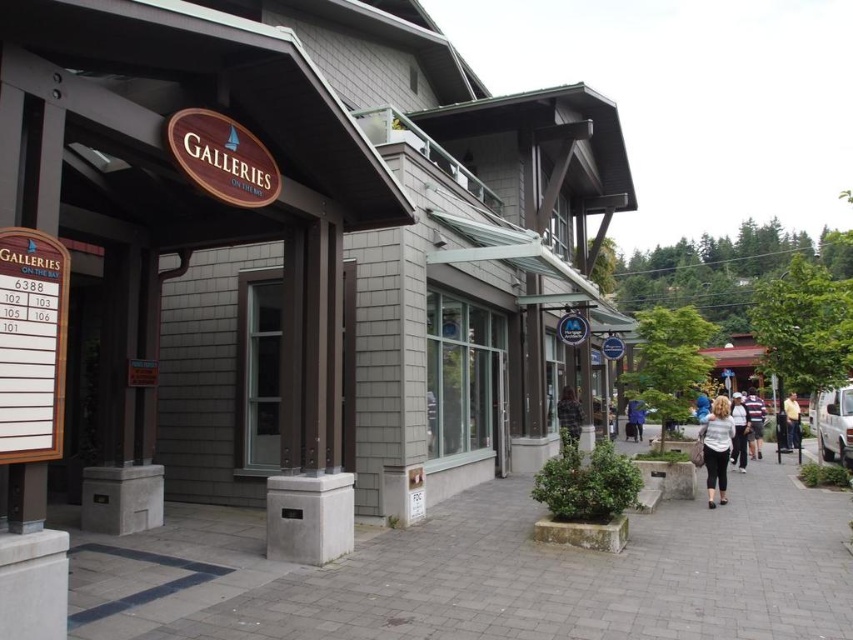
A photographer wants to capture the Galleries on the Bay building while ensuring the light brown leather jacket at center is visible in the foreground. Based on its position, where should the photographer stand to include both the building and the jacket in the frame?

The light brown leather jacket at center is located at point (792, 420) in the image. To include both the Galleries on the Bay building and the jacket in the frame, the photographer should position themselves in a spot that allows the jacket to be in the foreground while still framing the building in the background. This would typically involve standing at an angle where the jacket is centered near the lower portion of the image and the building occupies the upper or central area. Adjusting the camera to

You are standing on the sidewalk in front of the Galleries on the Bay building. You notice a point at coordinates (792, 420). Which object does this point correspond to?

The point at coordinates (792, 420) corresponds to the light brown leather jacket at center.